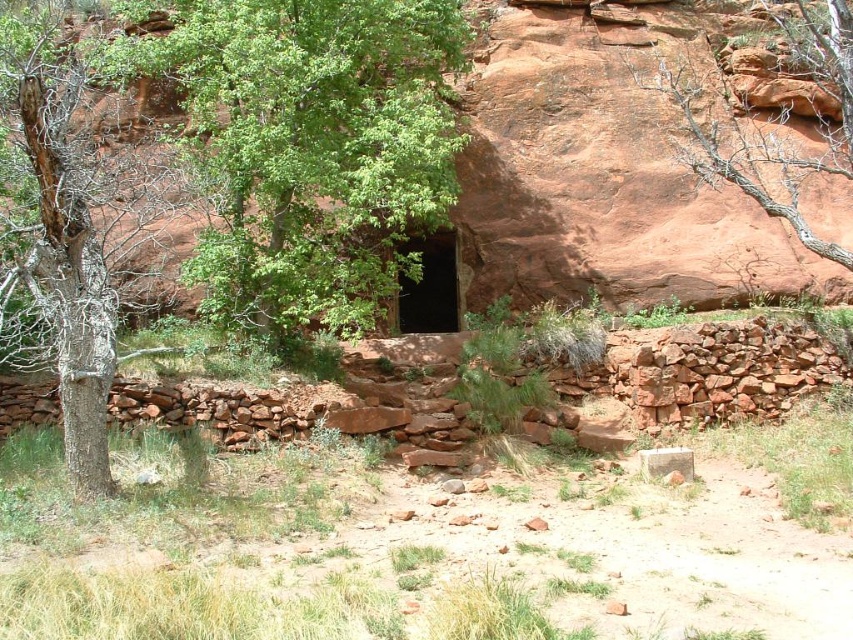
You are planning to place a small garden statue that is 1 meter tall in the scene. Given the sizes of the green leafy tree at center and the black stone entrance at center, which object would be a better reference point to ensure the statue doesn

The green leafy tree at center is larger in size than the black stone entrance at center, so placing the statue near the black stone entrance at center would provide a better scale reference since the entrance is smaller and closer in size to the statue.